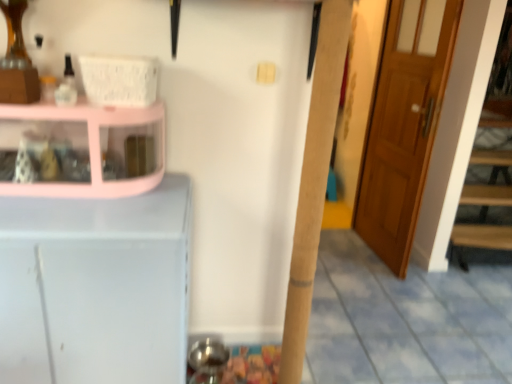
Question: Does white matte cabinet at left have a smaller size compared to pink glossy cabinet at left?

Choices:
 (A) no
 (B) yes

Answer: (A)

Question: From a real-world perspective, does white matte cabinet at left stand above pink glossy cabinet at left?

Choices:
 (A) yes
 (B) no

Answer: (B)

Question: Does white matte cabinet at left have a greater width compared to pink glossy cabinet at left?

Choices:
 (A) yes
 (B) no

Answer: (A)

Question: From a real-world perspective, is white matte cabinet at left beneath pink glossy cabinet at left?

Choices:
 (A) no
 (B) yes

Answer: (B)

Question: Is white matte cabinet at left positioned in front of pink glossy cabinet at left?

Choices:
 (A) yes
 (B) no

Answer: (A)

Question: Do you think wooden door at right is within white matte cabinet at left, or outside of it?

Choices:
 (A) outside
 (B) inside

Answer: (A)

Question: From a real-world perspective, is wooden door at right physically located above or below white matte cabinet at left?

Choices:
 (A) below
 (B) above

Answer: (B)

Question: Is wooden door at right wider or thinner than white matte cabinet at left?

Choices:
 (A) wide
 (B) thin

Answer: (B)

Question: Relative to white matte cabinet at left, is wooden door at right in front or behind?

Choices:
 (A) behind
 (B) front

Answer: (A)

Question: Is pink glossy cabinet at left bigger or smaller than wooden door at right?

Choices:
 (A) big
 (B) small

Answer: (B)

Question: From the image's perspective, relative to wooden door at right, is pink glossy cabinet at left above or below?

Choices:
 (A) above
 (B) below

Answer: (B)

Question: Looking at their shapes, would you say pink glossy cabinet at left is wider or thinner than wooden door at right?

Choices:
 (A) thin
 (B) wide

Answer: (B)

Question: Considering the relative positions of pink glossy cabinet at left and wooden door at right in the image provided, is pink glossy cabinet at left to the left or to the right of wooden door at right?

Choices:
 (A) left
 (B) right

Answer: (A)

Question: Would you say white matte cabinet at left is to the left or to the right of pink glossy cabinet at left in the picture?

Choices:
 (A) right
 (B) left

Answer: (B)

Question: Is white matte cabinet at left inside or outside of pink glossy cabinet at left?

Choices:
 (A) inside
 (B) outside

Answer: (B)